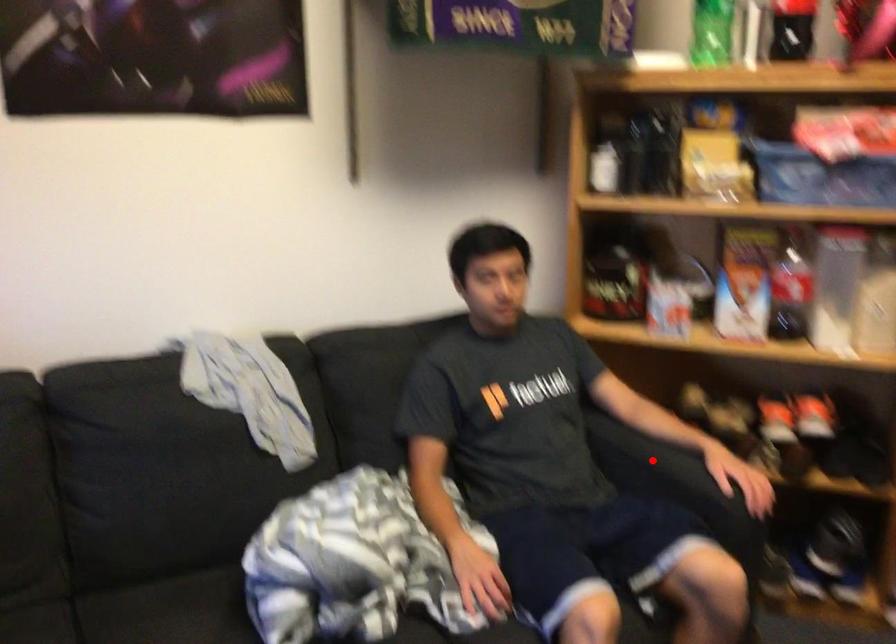
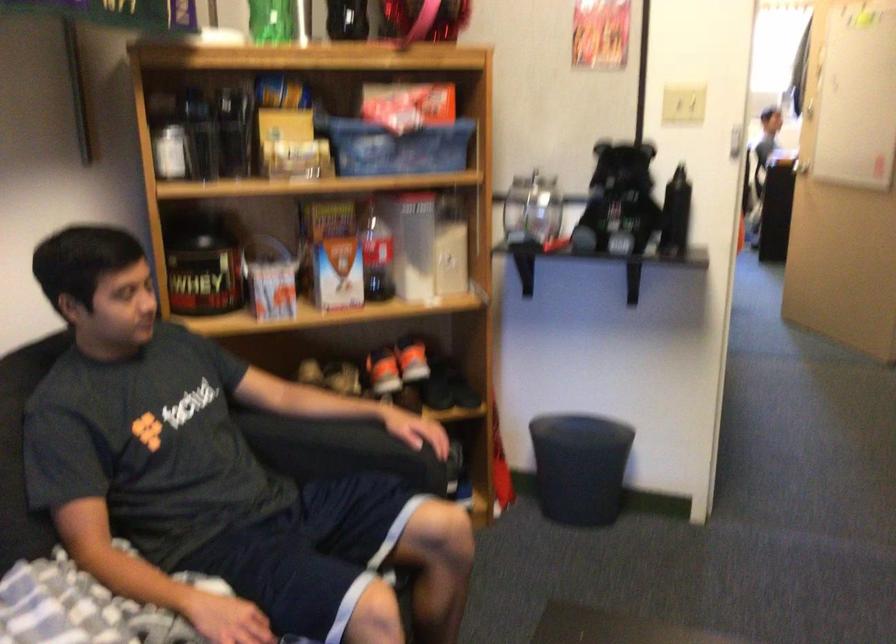
In the second image, find the point that corresponds to the highlighted location in the first image.

(330, 444)